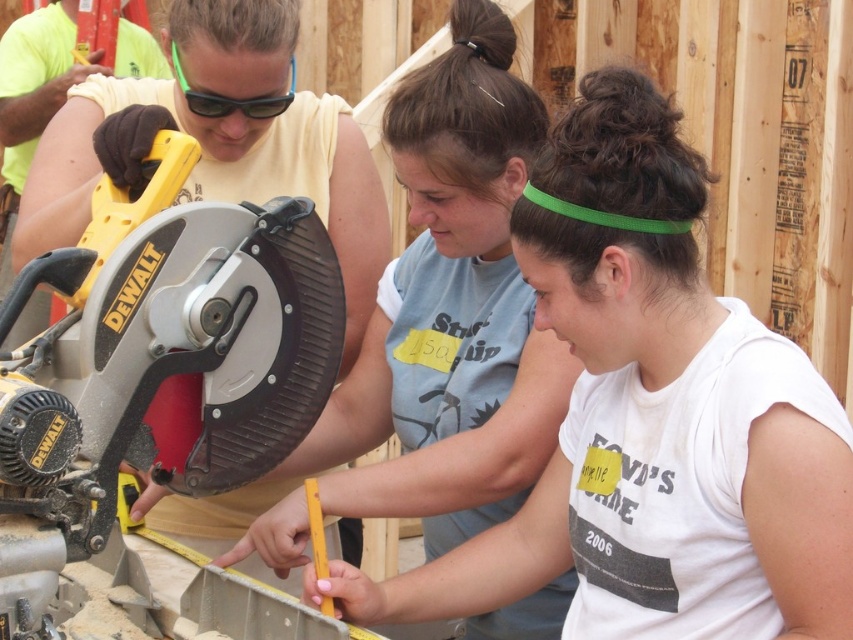
Which of these two, matte yellow shirt at center or green plastic goggles at upper center, stands shorter?

With less height is green plastic goggles at upper center.

Who is lower down, matte yellow shirt at center or green plastic goggles at upper center?

matte yellow shirt at center

Which is behind, point (451, 380) or point (258, 108)?

Point (451, 380)

Identify the location of matte yellow shirt at center. (451, 308).

Is point (80, 364) farther from camera compared to point (457, 81)?

No, (80, 364) is in front of (457, 81).

Which is below, yellow plastic circular saw at left or matte yellow shirt at center?

yellow plastic circular saw at left is lower down.

I want to click on yellow plastic circular saw at left, so click(155, 362).

Locate an element on the screen. The width and height of the screenshot is (853, 640). yellow plastic circular saw at left is located at coordinates (155, 362).

Does white matte shirt at center lie in front of yellow plastic circular saw at left?

No, it is not.

This screenshot has height=640, width=853. Identify the location of white matte shirt at center. (651, 419).

Does point (595, 179) come behind point (299, 339)?

No, (595, 179) is closer to viewer.

You are a GUI agent. You are given a task and a screenshot of the screen. Output one action in this format:
    pyautogui.click(x=<x>, y=<y>)
    Task: Click on the white matte shirt at center
    The image size is (853, 640).
    Given the screenshot: What is the action you would take?
    pyautogui.click(x=651, y=419)